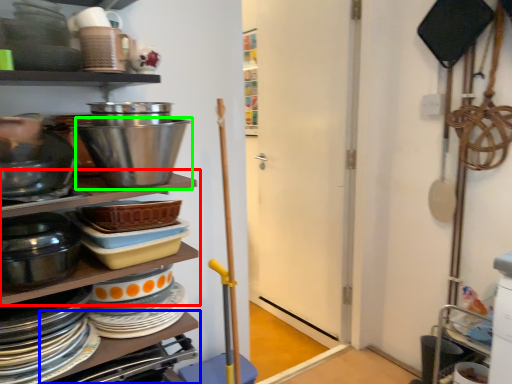
Question: Which is nearer to the shelf (highlighted by a red box)? table (highlighted by a blue box) or bowl (highlighted by a green box).

Choices:
 (A) table
 (B) bowl

Answer: (B)